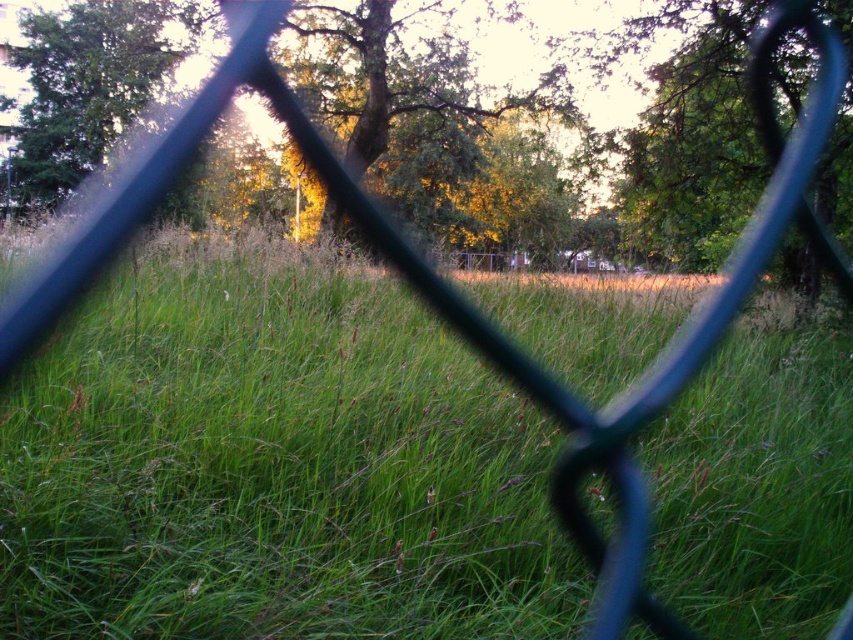
You are standing in front of the chain link fence and want to know the exact position of the green grassy area. What are the coordinates of the green grassy at center?

The coordinates of the green grassy at center are at point (273, 465).

You are a landscape photographer planning to capture the scene through the fence. Which object, the green grassy at center or the green leafy tree at upper left, would occupy a smaller portion of your photo?

The green grassy at center occupies less space than the green leafy tree at upper left, so it would occupy a smaller portion of the photo.

You are standing behind the chain link fence and want to take a photo of the green grassy at center and the green leafy tree at upper left. Which object will appear wider in the photo?

The green leafy tree at upper left will appear wider in the photo because it has a greater width than the green grassy at center.